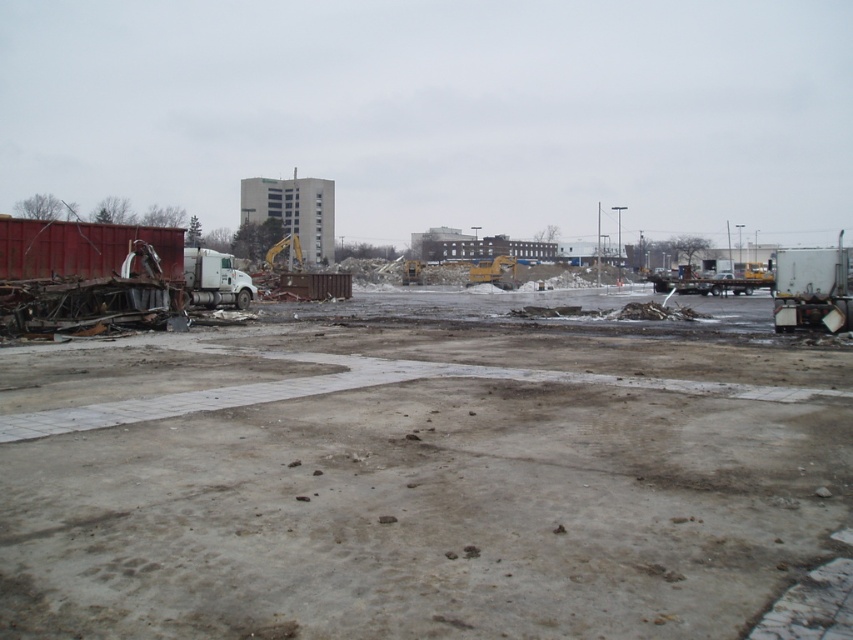
Does rusty metal debris at left have a greater width compared to white matte trailer truck at right?

No, rusty metal debris at left is not wider than white matte trailer truck at right.

Is rusty metal debris at left shorter than white matte trailer truck at right?

Yes, rusty metal debris at left is shorter than white matte trailer truck at right.

Who is more forward, (398, 289) or (804, 276)?

Point (804, 276)

Where is `rusty metal debris at left`? rusty metal debris at left is located at coordinates (422, 472).

In the scene shown: Is rusty metal debris at left positioned at the back of white matte trailer truck at left?

No, rusty metal debris at left is in front of white matte trailer truck at left.

Does rusty metal debris at left have a greater height compared to white matte trailer truck at left?

No, rusty metal debris at left is not taller than white matte trailer truck at left.

Describe the element at coordinates (422, 472) in the screenshot. I see `rusty metal debris at left` at that location.

Find the location of a particular element. rusty metal debris at left is located at coordinates (422, 472).

Is white matte trailer truck at right below white matte trailer truck at left?

Actually, white matte trailer truck at right is above white matte trailer truck at left.

Between white matte trailer truck at right and white matte trailer truck at left, which one has less height?

white matte trailer truck at left is shorter.

Which is behind, point (799, 308) or point (206, 305)?

Point (206, 305)

At what (x,y) coordinates should I click in order to perform the action: click on white matte trailer truck at right. Please return your answer as a coordinate pair (x, y). This screenshot has height=640, width=853. Looking at the image, I should click on (811, 289).